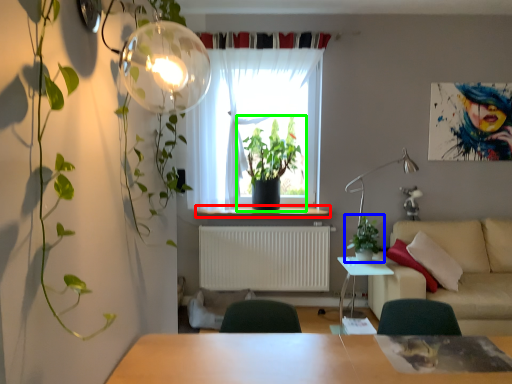
Question: Based on their relative distances, which object is nearer to window sill (highlighted by a red box)? Choose from houseplant (highlighted by a blue box) and houseplant (highlighted by a green box).

Choices:
 (A) houseplant
 (B) houseplant

Answer: (B)